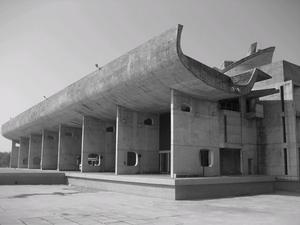
The width and height of the screenshot is (300, 225). I want to click on back wall, so click(x=273, y=126).